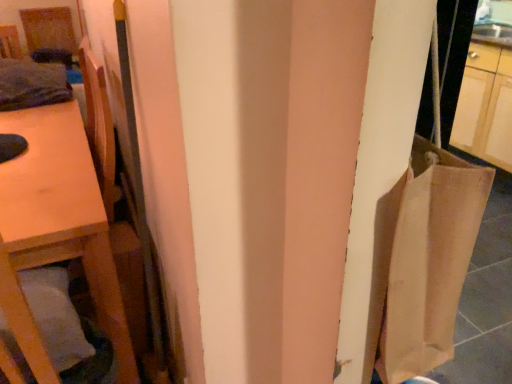
The image size is (512, 384). Find the location of `free space above wooden table at left (from a real-world perspective)`. free space above wooden table at left (from a real-world perspective) is located at coordinates (36, 153).